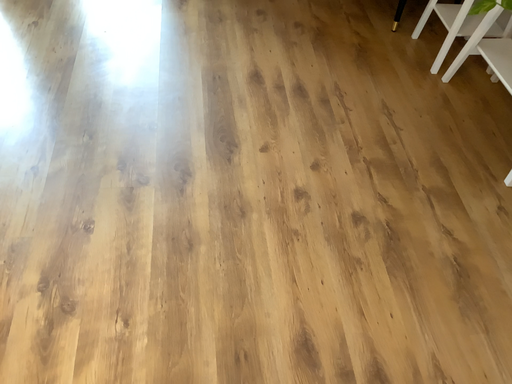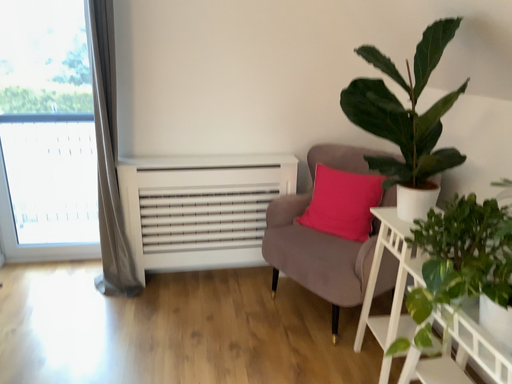
Question: Which way did the camera rotate in the video?

Choices:
 (A) rotated downward
 (B) rotated upward

Answer: (B)